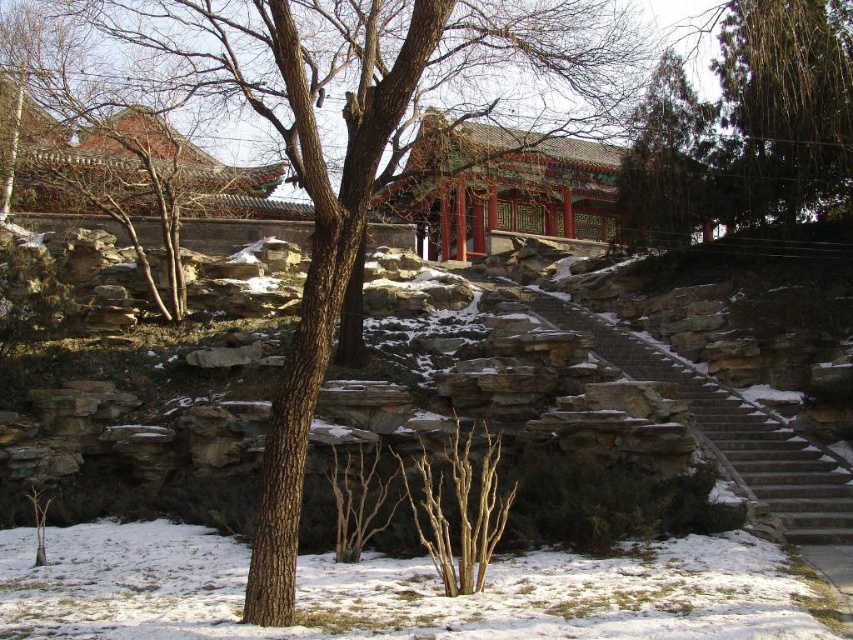
Does brown stone stairs at center have a lesser height compared to bare wood at center?

In fact, brown stone stairs at center may be taller than bare wood at center.

Does brown stone stairs at center appear on the right side of bare wood at center?

Yes, brown stone stairs at center is to the right of bare wood at center.

Identify the location of brown stone stairs at center. The width and height of the screenshot is (853, 640). (730, 429).

Image resolution: width=853 pixels, height=640 pixels. I want to click on brown stone stairs at center, so click(x=730, y=429).

Between point (763, 442) and point (630, 148), which one is positioned behind?

Point (630, 148)

Can you confirm if brown stone stairs at center is shorter than green textured pine tree at upper right?

Yes, brown stone stairs at center is shorter than green textured pine tree at upper right.

Locate an element on the screen. brown stone stairs at center is located at coordinates (730, 429).

Find the location of `brown stone stairs at center`. brown stone stairs at center is located at coordinates (730, 429).

Does green textured tree at upper right have a greater width compared to bare wood at center?

Yes.

Is point (787, 67) farther from viewer compared to point (477, 460)?

Yes, point (787, 67) is farther from viewer.

Image resolution: width=853 pixels, height=640 pixels. Identify the location of green textured tree at upper right. (788, 100).